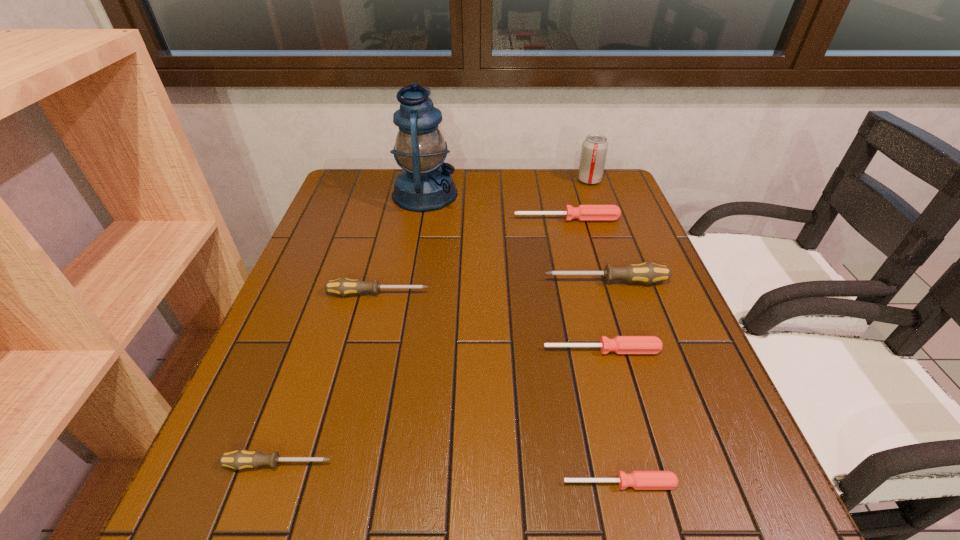
Where is `gray screwdriver that is the third closest to the blue lantern`? The height and width of the screenshot is (540, 960). gray screwdriver that is the third closest to the blue lantern is located at coordinates (239, 459).

Point out which gray screwdriver is positioned as the second nearest to the second biggest red screwdriver. Please provide its 2D coordinates. Your answer should be formatted as a tuple, i.e. [(x, y)], where the tuple contains the x and y coordinates of a point satisfying the conditions above.

[(343, 286)]

Image resolution: width=960 pixels, height=540 pixels. I want to click on red screwdriver that stands as the closest to the fifth farthest screwdriver, so click(640, 480).

Identify which red screwdriver is the second closest to the soda can. Please provide its 2D coordinates. Your answer should be formatted as a tuple, i.e. [(x, y)], where the tuple contains the x and y coordinates of a point satisfying the conditions above.

[(620, 344)]

The height and width of the screenshot is (540, 960). I want to click on vacant space that satisfies the following two spatial constraints: 1. on the face of the blue lantern; 2. on the left side of the third nearest screwdriver, so click(397, 350).

I want to click on vacant space that satisfies the following two spatial constraints: 1. on the face of the nearest object; 2. on the left side of the lantern, so pos(374,483).

Where is `vacant space that satisfies the following two spatial constraints: 1. at the tip of the nearest screwdriver; 2. on the left side of the second biggest gray screwdriver`? vacant space that satisfies the following two spatial constraints: 1. at the tip of the nearest screwdriver; 2. on the left side of the second biggest gray screwdriver is located at coordinates (331, 483).

Image resolution: width=960 pixels, height=540 pixels. Find the location of `vacant space that satisfies the following two spatial constraints: 1. at the tip of the tallest screwdriver; 2. on the front side of the second nearest red screwdriver`. vacant space that satisfies the following two spatial constraints: 1. at the tip of the tallest screwdriver; 2. on the front side of the second nearest red screwdriver is located at coordinates (628, 350).

Locate an element on the screen. vacant point that satisfies the following two spatial constraints: 1. on the face of the second biggest red screwdriver; 2. on the right side of the tallest object is located at coordinates (397, 350).

This screenshot has width=960, height=540. What are the coordinates of `free location that satisfies the following two spatial constraints: 1. at the tip of the second biggest gray screwdriver; 2. on the right side of the fourth farthest screwdriver` in the screenshot? It's located at point(364,350).